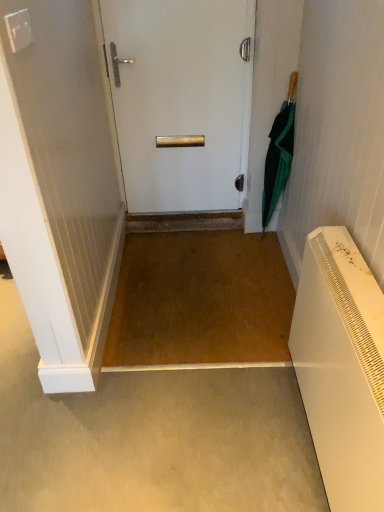
Where is `free point to the left of green fabric umbrella at right`? This screenshot has height=512, width=384. free point to the left of green fabric umbrella at right is located at coordinates (238, 242).